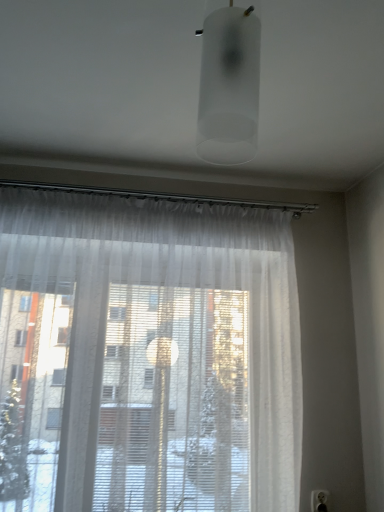
Question: Choose the correct answer: Is frosted glass cylinder at upper center inside sheer white curtain at center or outside it?

Choices:
 (A) outside
 (B) inside

Answer: (A)

Question: Would you say frosted glass cylinder at upper center is to the left or to the right of sheer white curtain at center in the picture?

Choices:
 (A) right
 (B) left

Answer: (A)

Question: Estimate the real-world distances between objects in this image. Which object is farther from the frosted glass cylinder at upper center?

Choices:
 (A) white plastic electric outlet at lower right
 (B) sheer white curtain at center

Answer: (A)

Question: Estimate the real-world distances between objects in this image. Which object is farther from the sheer white curtain at center?

Choices:
 (A) frosted glass cylinder at upper center
 (B) white plastic electric outlet at lower right

Answer: (B)